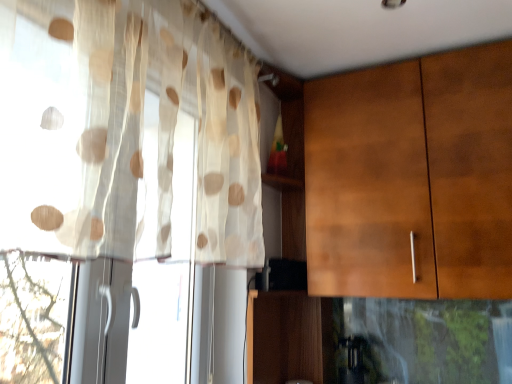
What do you see at coordinates (412, 178) in the screenshot? The image size is (512, 384). I see `matte brown cabinet at right` at bounding box center [412, 178].

You are a GUI agent. You are given a task and a screenshot of the screen. Output one action in this format:
    pyautogui.click(x=<x>, y=<y>)
    Task: Click on the matte brown cabinet at right
    
    Given the screenshot: What is the action you would take?
    pyautogui.click(x=412, y=178)

Locate an element on the screen. matte brown cabinet at right is located at coordinates (412, 178).